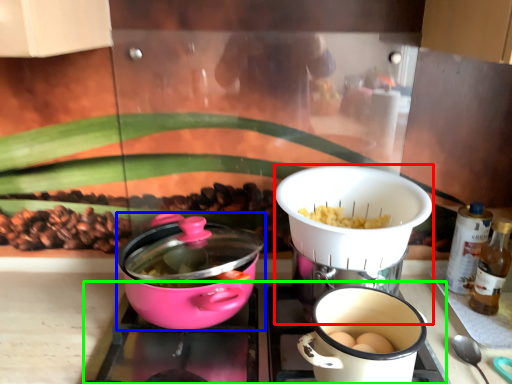
Question: Which object is the closest to the kitchen appliance (highlighted by a red box)? Choose among these: kitchen appliance (highlighted by a blue box) or gas stove (highlighted by a green box).

Choices:
 (A) kitchen appliance
 (B) gas stove

Answer: (B)